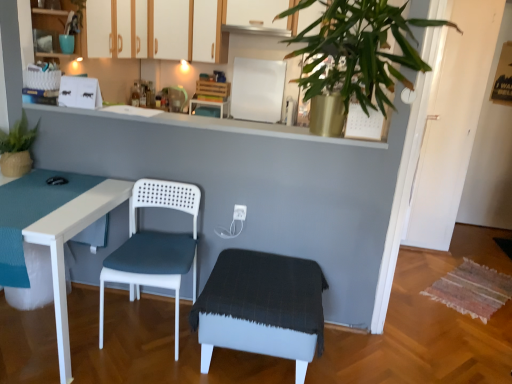
Locate an element on the screen. Image resolution: width=512 pixels, height=384 pixels. vacant space underneath white fabric step stool at center (from a real-world perspective) is located at coordinates tap(247, 365).